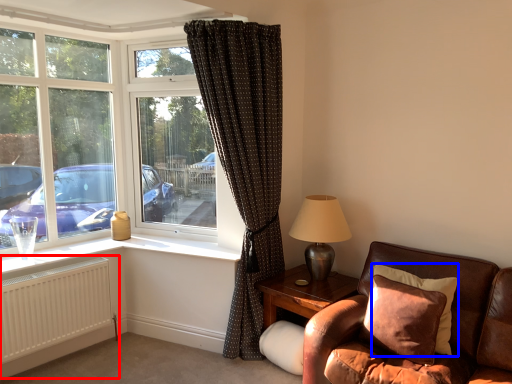
Question: Which object is closer to the camera taking this photo, radiator (highlighted by a red box) or pillow (highlighted by a blue box)?

Choices:
 (A) radiator
 (B) pillow

Answer: (B)